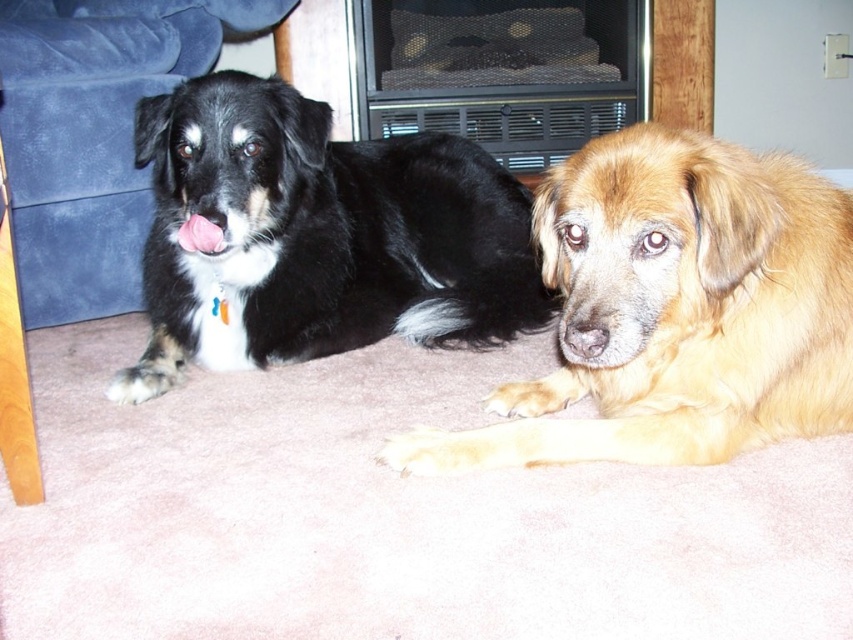
Question: Does golden fur dog at center have a greater width compared to black soft fur dog at left?

Choices:
 (A) no
 (B) yes

Answer: (A)

Question: Estimate the real-world distances between objects in this image. Which object is closer to the suede couch at left?

Choices:
 (A) black soft fur dog at left
 (B) golden fur dog at center

Answer: (A)

Question: Among these objects, which one is nearest to the camera?

Choices:
 (A) black soft fur dog at left
 (B) golden fur dog at center
 (C) suede couch at left

Answer: (B)

Question: Does golden fur dog at center appear on the right side of black soft fur dog at left?

Choices:
 (A) yes
 (B) no

Answer: (A)

Question: Is golden fur dog at center above black soft fur dog at left?

Choices:
 (A) no
 (B) yes

Answer: (A)

Question: Which object is the closest to the suede couch at left?

Choices:
 (A) golden fur dog at center
 (B) black soft fur dog at left

Answer: (B)